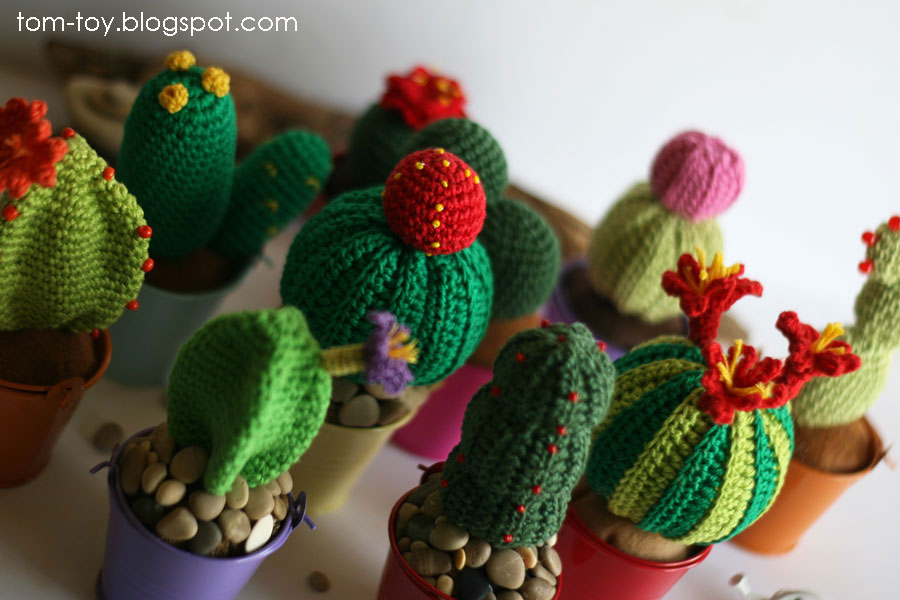
The height and width of the screenshot is (600, 900). I want to click on purple pot, so click(212, 567).